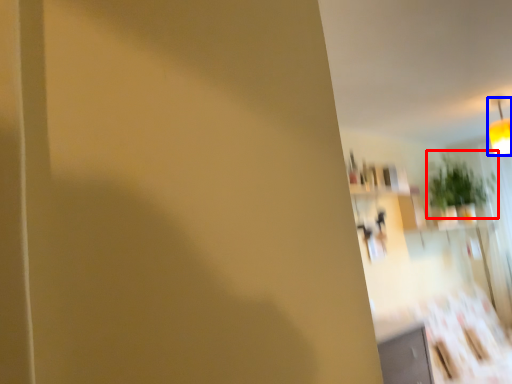
Question: Which point is further to the camera, plant (highlighted by a red box) or light fixture (highlighted by a blue box)?

Choices:
 (A) plant
 (B) light fixture

Answer: (A)